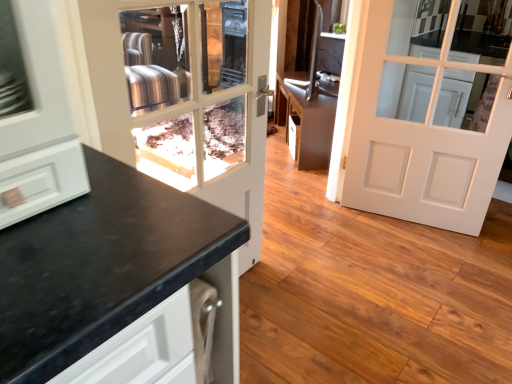
Where is `free space in front of white matte door at center, placed as the second door when sorted from left to right`? The image size is (512, 384). free space in front of white matte door at center, placed as the second door when sorted from left to right is located at coordinates (423, 264).